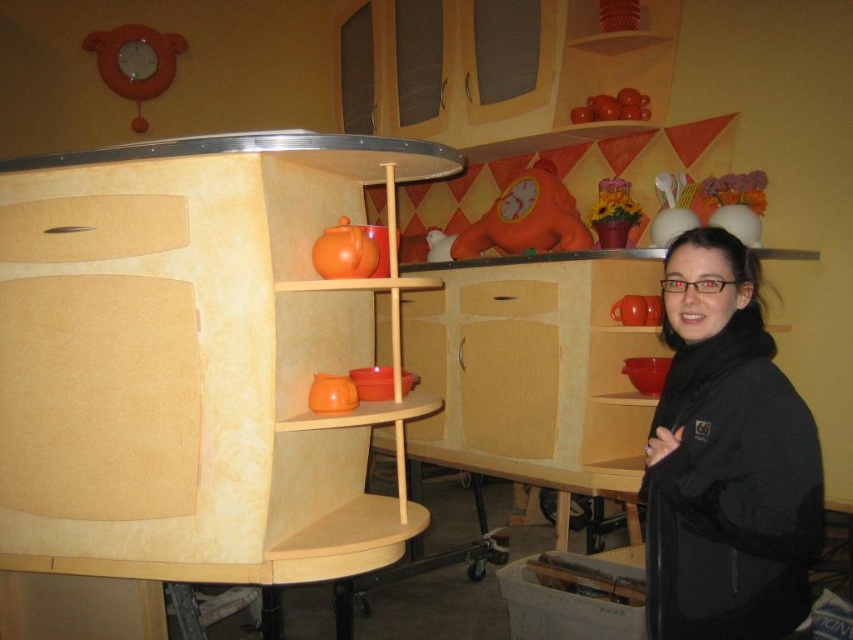
Question: Which object is closer to the camera taking this photo?

Choices:
 (A) black soft jacket at right
 (B) white cardboard box at lower center

Answer: (A)

Question: Is black soft jacket at right further to camera compared to white cardboard box at lower center?

Choices:
 (A) no
 (B) yes

Answer: (A)

Question: Observing the image, what is the correct spatial positioning of black soft jacket at right in reference to white cardboard box at lower center?

Choices:
 (A) above
 (B) below

Answer: (A)

Question: Is black soft jacket at right positioned before white cardboard box at lower center?

Choices:
 (A) no
 (B) yes

Answer: (B)

Question: Which point is farther to the camera?

Choices:
 (A) white cardboard box at lower center
 (B) black soft jacket at right

Answer: (A)

Question: Which of the following is the farthest from the observer?

Choices:
 (A) (567, 598)
 (B) (683, 449)

Answer: (A)